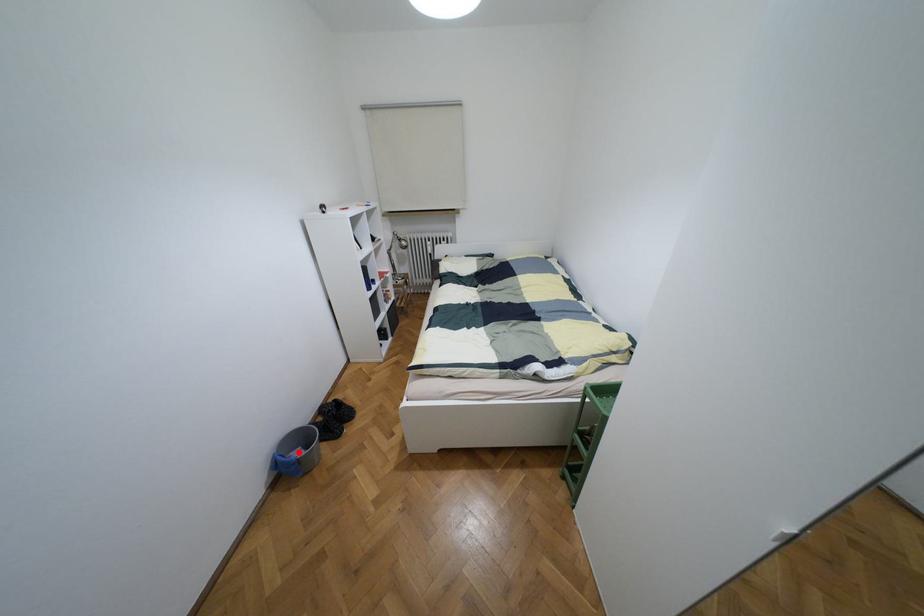
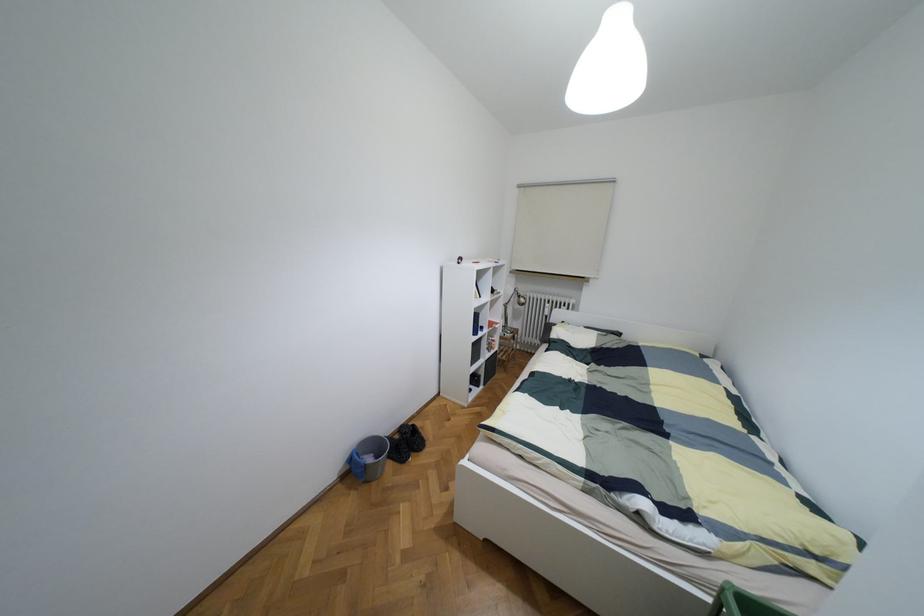
Question: I am providing you with two images of the same scene from different viewpoints. In image1, a red point is highlighted. Considering the same 3D point in image2, which of the following is correct?

Choices:
 (A) It is closer
 (B) It is farther

Answer: (B)